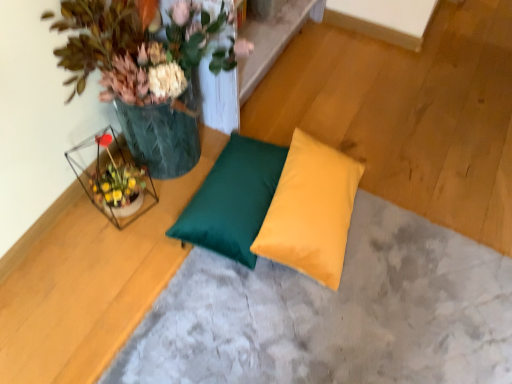
The width and height of the screenshot is (512, 384). What are the coordinates of `free point in front of green leafy plant at upper left` in the screenshot? It's located at (111, 255).